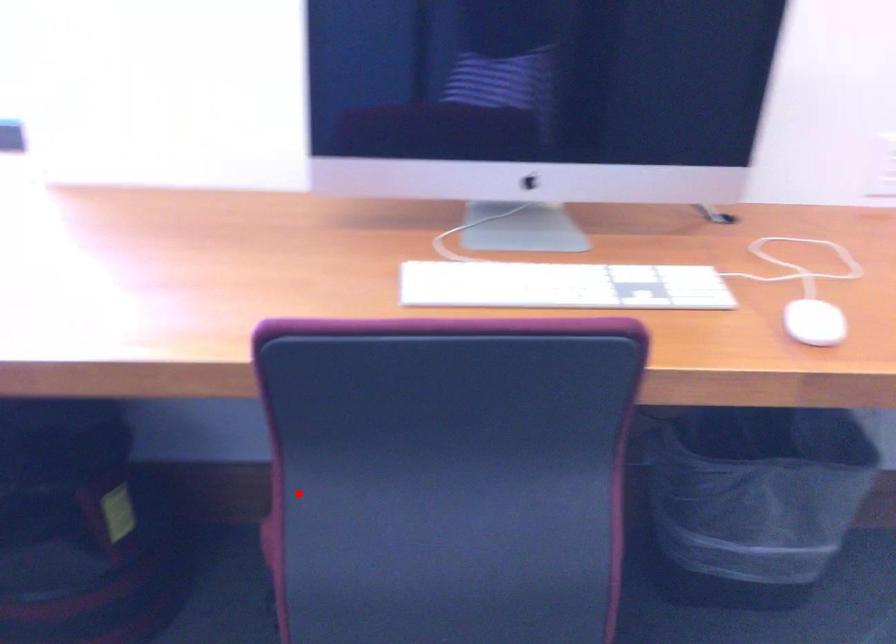
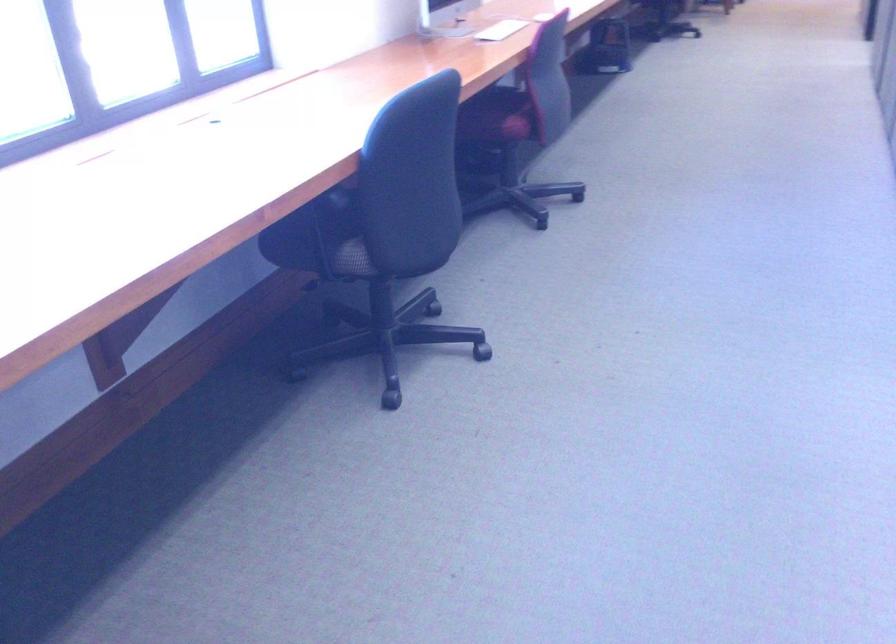
Find the pixel in the second image that matches the highlighted location in the first image.

(497, 116)